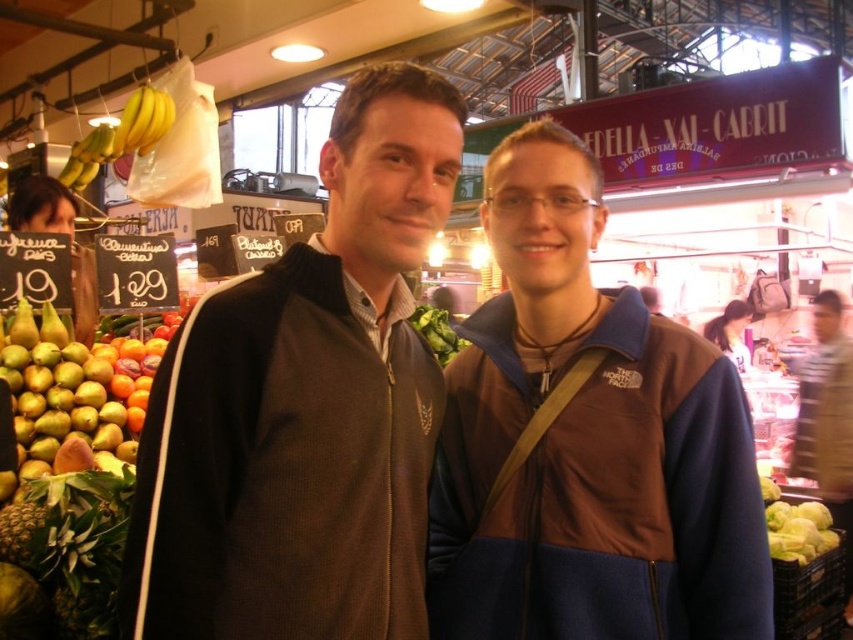
You are standing in the market and want to find the green leafy at left. Which direction should you look to locate it?

The green leafy at left is located at the point with coordinates 0.852 on the x axis and 0.086 on the y axis, so you should look towards the upper right direction from your current position.

Consider the image. You are a photographer trying to capture both the brown textured jacket at center and the brown fleece jacket at center in a single shot. Based on their positions, which jacket will appear larger in the photo?

The brown textured jacket at center will appear larger in the photo because it is closer to the viewer than the brown fleece jacket at center.